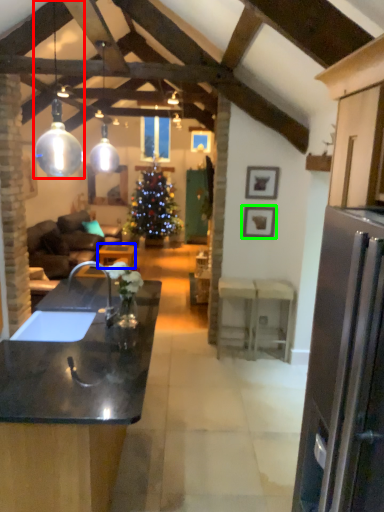
Question: Considering the real-world distances, which object is closest to lamp (highlighted by a red box)? table (highlighted by a blue box) or picture frame (highlighted by a green box).

Choices:
 (A) table
 (B) picture frame

Answer: (B)